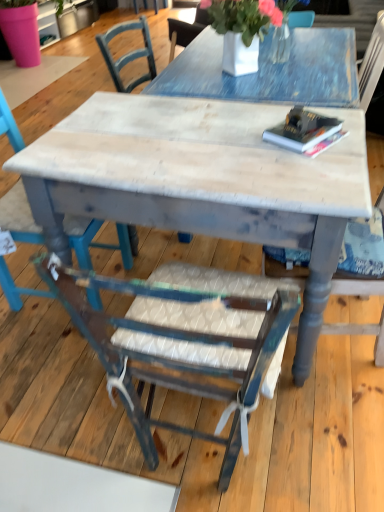
Question: Can you confirm if distressed wood table at center is smaller than distressed wood chair at lower left, which appears as the 1th chair when viewed from the left?

Choices:
 (A) no
 (B) yes

Answer: (A)

Question: Is distressed wood table at center far away from distressed wood chair at lower left, which appears as the 1th chair when viewed from the left?

Choices:
 (A) yes
 (B) no

Answer: (B)

Question: Considering the relative sizes of distressed wood table at center and distressed wood chair at lower left, which appears as the 1th chair when viewed from the left, in the image provided, is distressed wood table at center bigger than distressed wood chair at lower left, which appears as the 1th chair when viewed from the left,?

Choices:
 (A) yes
 (B) no

Answer: (A)

Question: Considering the relative sizes of distressed wood table at center and distressed wood chair at lower left, which is counted as the third chair, starting from the right, in the image provided, is distressed wood table at center wider than distressed wood chair at lower left, which is counted as the third chair, starting from the right,?

Choices:
 (A) no
 (B) yes

Answer: (B)

Question: From a real-world perspective, is distressed wood table at center positioned under distressed wood chair at lower left, which appears as the 1th chair when viewed from the left, based on gravity?

Choices:
 (A) yes
 (B) no

Answer: (A)

Question: From the image's perspective, is distressed wood table at center above or below wooden chair with woven seat at center, which is the 2th chair in right-to-left order?

Choices:
 (A) below
 (B) above

Answer: (B)

Question: Is point (221, 185) positioned closer to the camera than point (243, 382)?

Choices:
 (A) farther
 (B) closer

Answer: (A)

Question: From a real-world perspective, is distressed wood table at center physically located above or below wooden chair with woven seat at center, which is the 2th chair in left-to-right order?

Choices:
 (A) below
 (B) above

Answer: (A)

Question: Would you say distressed wood table at center is to the left or to the right of wooden chair with woven seat at center, which is the 2th chair in left-to-right order, in the picture?

Choices:
 (A) right
 (B) left

Answer: (B)

Question: From their relative heights in the image, would you say wooden chair with woven seat at center, which is the 2th chair in left-to-right order, is taller or shorter than wooden chair at right, arranged as the first chair when viewed from the right?

Choices:
 (A) short
 (B) tall

Answer: (A)

Question: Looking at the image, does wooden chair with woven seat at center, which is the 2th chair in left-to-right order, seem bigger or smaller compared to wooden chair at right, arranged as the first chair when viewed from the right?

Choices:
 (A) small
 (B) big

Answer: (A)

Question: Is wooden chair with woven seat at center, which is the 2th chair in right-to-left order, to the left or to the right of wooden chair at right, arranged as the first chair when viewed from the right, in the image?

Choices:
 (A) left
 (B) right

Answer: (A)

Question: Considering the positions of point (177, 387) and point (359, 329), is point (177, 387) closer or farther from the camera than point (359, 329)?

Choices:
 (A) farther
 (B) closer

Answer: (B)

Question: In terms of height, does distressed wood chair at lower left, which appears as the 1th chair when viewed from the left, look taller or shorter compared to wooden chair at right, arranged as the first chair when viewed from the right?

Choices:
 (A) tall
 (B) short

Answer: (A)

Question: Considering the positions of distressed wood chair at lower left, which appears as the 1th chair when viewed from the left, and wooden chair at right, which is counted as the third chair, starting from the left, in the image, is distressed wood chair at lower left, which appears as the 1th chair when viewed from the left, wider or thinner than wooden chair at right, which is counted as the third chair, starting from the left,?

Choices:
 (A) wide
 (B) thin

Answer: (B)